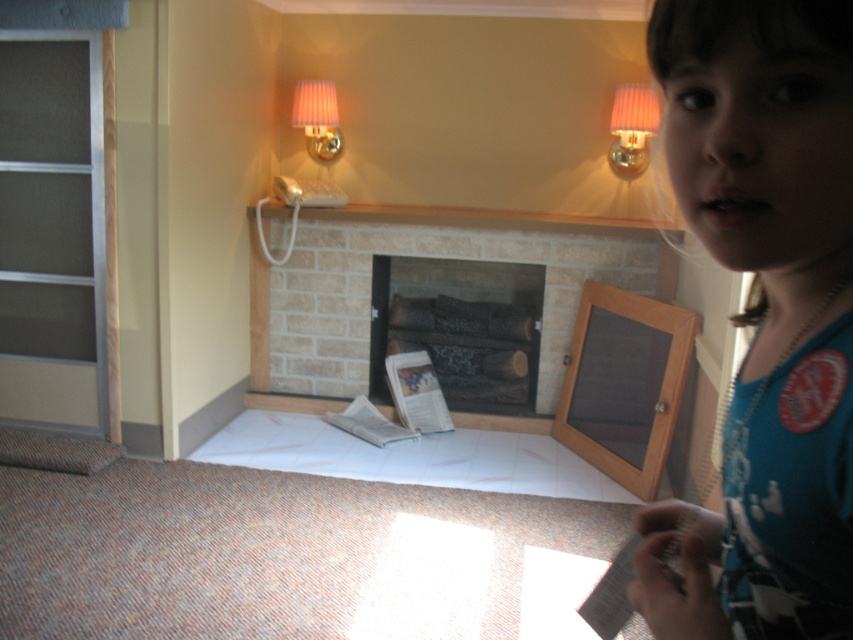
You are organizing a miniature display and need to place a small figurine between the blue cotton shirt at upper right and the pink fabric lampshade at upper center. Based on their sizes, which object should the figurine be placed closer to?

The blue cotton shirt at upper right has a smaller size compared to the pink fabric lampshade at upper center, so the figurine should be placed closer to the pink fabric lampshade at upper center to maintain balance.

You are a small toy mouse that is 3 cm wide. You want to move from the sliding door to the fireplace. Can you pass between the charcoal wood logs at center and the pink fabric lampshade at upper center without getting stuck?

The charcoal wood logs at center might be wider than the pink fabric lampshade at upper center, so there might be enough space for the toy mouse to pass through.